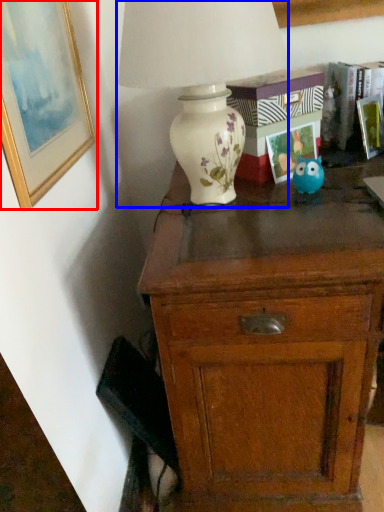
Question: Which object appears closest to the camera in this image, picture frame (highlighted by a red box) or lamp (highlighted by a blue box)?

Choices:
 (A) picture frame
 (B) lamp

Answer: (A)